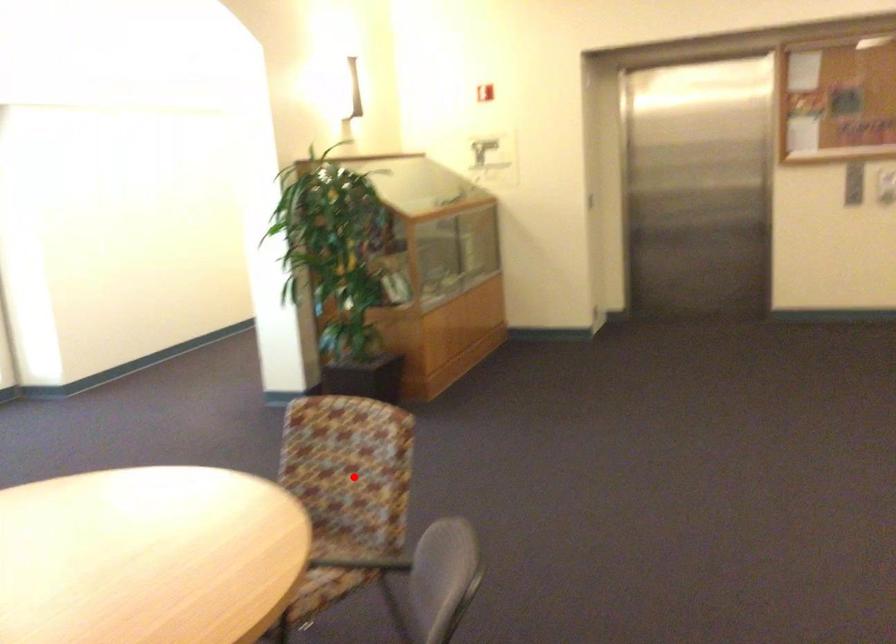
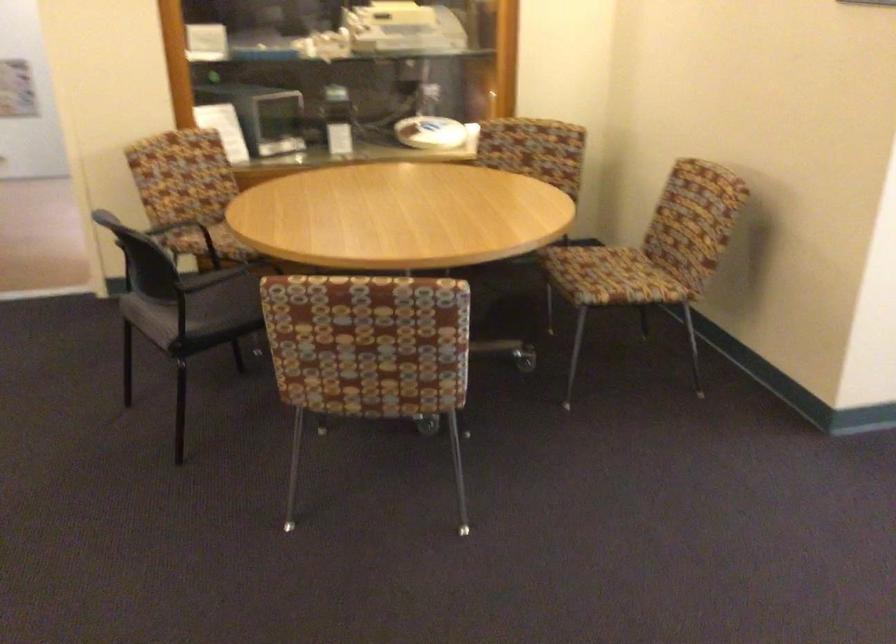
In the second image, find the point that corresponds to the highlighted location in the first image.

(368, 353)